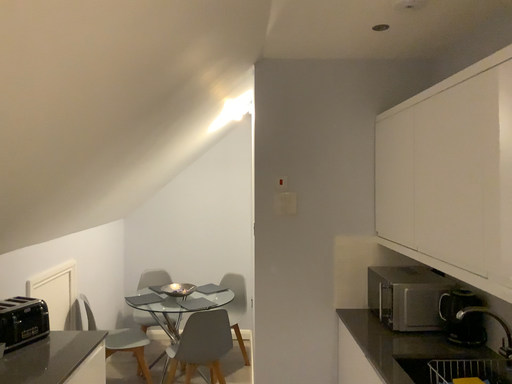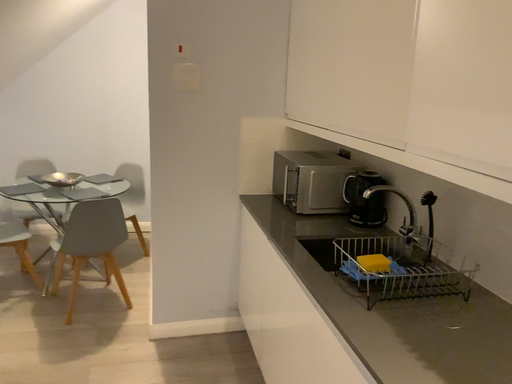
Question: Which way did the camera rotate in the video?

Choices:
 (A) rotated right
 (B) rotated left

Answer: (A)